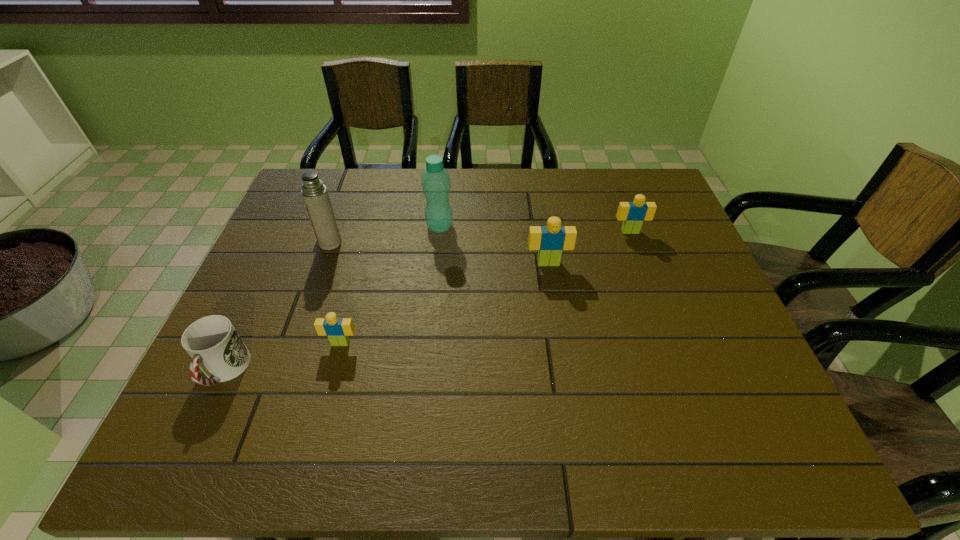
In the image, there is a desktop. Where is `vacant space at the near edge`? The width and height of the screenshot is (960, 540). vacant space at the near edge is located at coordinates (300, 381).

This screenshot has width=960, height=540. In the image, there is a desktop. Find the location of `vacant space at the left edge`. vacant space at the left edge is located at coordinates (247, 323).

This screenshot has width=960, height=540. What are the coordinates of `vacant space at the right edge of the desktop` in the screenshot? It's located at point(665,299).

In the image, there is a desktop. Where is `vacant space at the far right corner`? The height and width of the screenshot is (540, 960). vacant space at the far right corner is located at coordinates (659, 178).

The height and width of the screenshot is (540, 960). I want to click on free location at the near right corner, so click(x=767, y=394).

This screenshot has height=540, width=960. What are the coordinates of `free area in between the second Lego from left to right and the thermos bottle` in the screenshot? It's located at (440, 253).

Identify the location of empty space between the thermos bottle and the third object from left to right. (335, 293).

Locate an element on the screen. empty space that is in between the nearest Lego and the fourth farthest object is located at coordinates (444, 303).

You are a GUI agent. You are given a task and a screenshot of the screen. Output one action in this format:
    pyautogui.click(x=<x>, y=<y>)
    Task: Click on the vacant space in between the thermos bottle and the cup
    Image resolution: width=960 pixels, height=540 pixels.
    Given the screenshot: What is the action you would take?
    pyautogui.click(x=277, y=307)

In order to click on vacant region between the rightmost Lego and the leftmost Lego in this screenshot , I will do `click(486, 287)`.